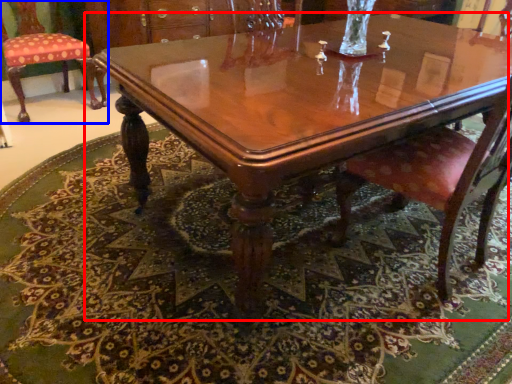
Question: Among these objects, which one is farthest to the camera, coffee table (highlighted by a red box) or chair (highlighted by a blue box)?

Choices:
 (A) coffee table
 (B) chair

Answer: (B)